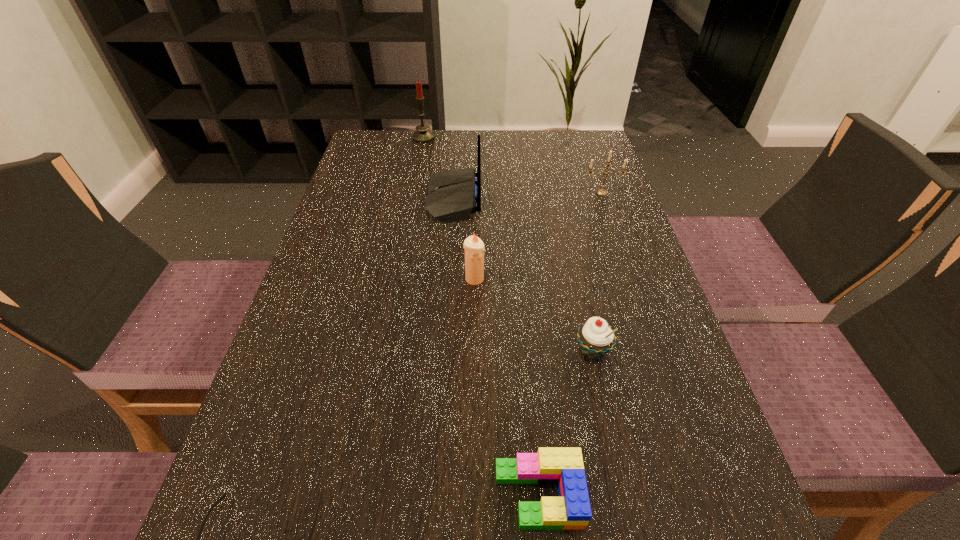
At what (x,y) coordinates should I click in order to perform the action: click on cupcake situated at the right edge. Please return your answer as a coordinate pair (x, y). Image resolution: width=960 pixels, height=540 pixels. Looking at the image, I should click on (596, 338).

Where is `object present at the far left corner`? object present at the far left corner is located at coordinates pyautogui.click(x=422, y=135).

Find the location of `vacant space at the far edge of the desktop`. vacant space at the far edge of the desktop is located at coordinates (524, 153).

Find the location of a particular element. The height and width of the screenshot is (540, 960). free space at the left edge is located at coordinates (382, 278).

I want to click on vacant space at the right edge of the desktop, so click(x=629, y=232).

Find the location of a particular element. The width and height of the screenshot is (960, 540). free space at the far right corner of the desktop is located at coordinates (554, 151).

This screenshot has width=960, height=540. Identify the location of free space between the router and the second shortest object. (496, 347).

The image size is (960, 540). Identify the location of free space between the router and the Lego. (496, 347).

Locate an element on the screen. The image size is (960, 540). vacant space that is in between the rightmost candle and the router is located at coordinates [528, 196].

At what (x,y) coordinates should I click in order to perform the action: click on vacant space that is in between the farthest object and the router. Please return your answer as a coordinate pair (x, y). Image resolution: width=960 pixels, height=540 pixels. Looking at the image, I should click on (439, 168).